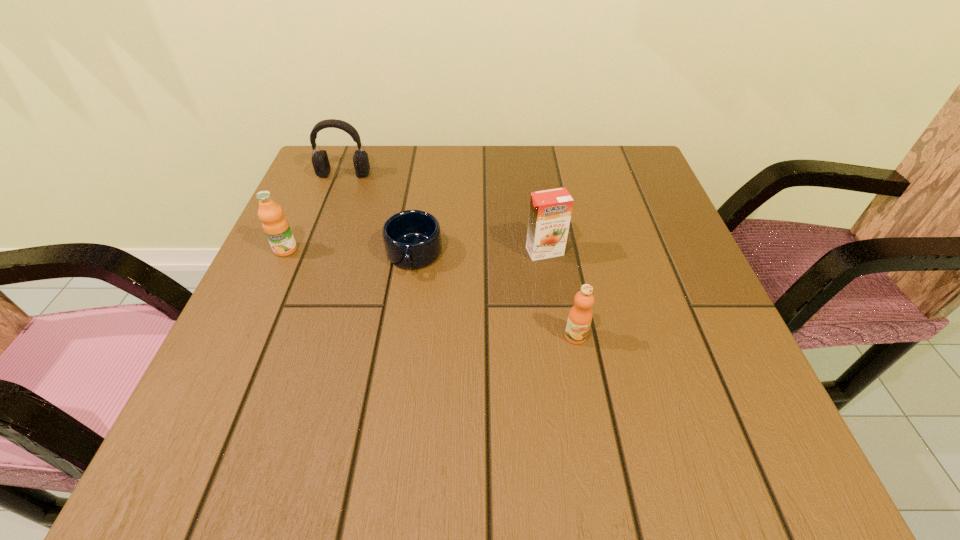
Where is `unoccupied position between the farthest object and the leftmost orange juice`? Image resolution: width=960 pixels, height=540 pixels. unoccupied position between the farthest object and the leftmost orange juice is located at coordinates (315, 212).

This screenshot has width=960, height=540. Find the location of `free spot between the nearest object and the third object from left to right`. free spot between the nearest object and the third object from left to right is located at coordinates (494, 296).

Identify the location of vacant area that lies between the headset and the leftmost orange juice. (315, 212).

Image resolution: width=960 pixels, height=540 pixels. In order to click on vacant region between the farthest object and the shortest object in this screenshot , I will do `click(379, 215)`.

Where is `vacant point located between the nearest orange juice and the mug`? The height and width of the screenshot is (540, 960). vacant point located between the nearest orange juice and the mug is located at coordinates (494, 296).

The height and width of the screenshot is (540, 960). Identify the location of vacant region between the headset and the leftmost orange juice. (315, 212).

Select which object appears as the third closest to the headset. Please provide its 2D coordinates. Your answer should be formatted as a tuple, i.e. [(x, y)], where the tuple contains the x and y coordinates of a point satisfying the conditions above.

[(550, 211)]

Locate which object ranks in proximity to the third object from right to left. Please provide its 2D coordinates. Your answer should be formatted as a tuple, i.e. [(x, y)], where the tuple contains the x and y coordinates of a point satisfying the conditions above.

[(550, 211)]

The width and height of the screenshot is (960, 540). In order to click on orange juice that is the second closest one to the nearest object in this screenshot , I will do `click(276, 227)`.

This screenshot has height=540, width=960. In order to click on orange juice that can be found as the closest to the third object from left to right in this screenshot , I will do `click(550, 211)`.